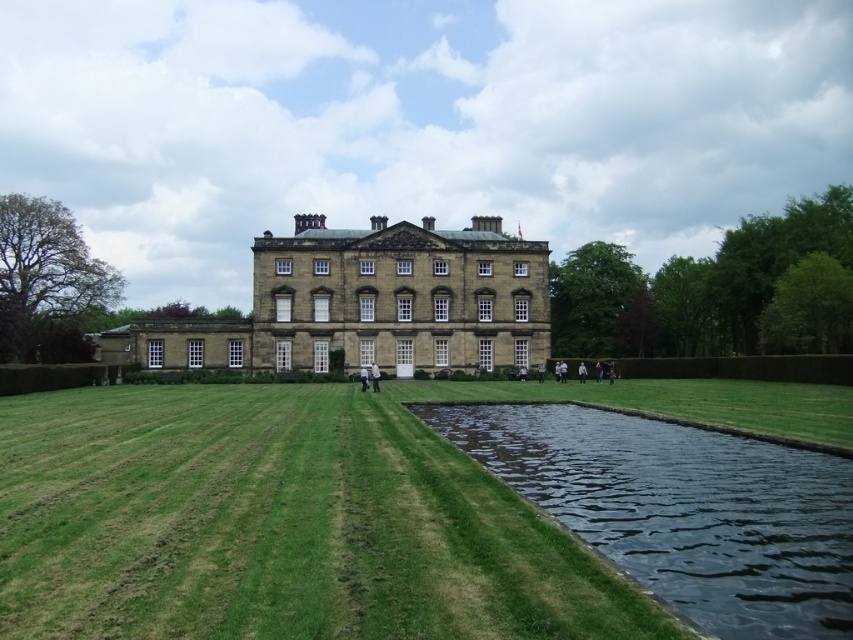
Can you confirm if dark reflective water at lower right is taller than brown stone mansion at center?

No.

Who is lower down, dark reflective water at lower right or brown stone mansion at center?

dark reflective water at lower right is lower down.

Locate an element on the screen. dark reflective water at lower right is located at coordinates (683, 509).

Find the location of `dark reflective water at lower right`. dark reflective water at lower right is located at coordinates (683, 509).

Can you confirm if green grass at center is thinner than dark reflective water at lower right?

In fact, green grass at center might be wider than dark reflective water at lower right.

What do you see at coordinates (276, 524) in the screenshot?
I see `green grass at center` at bounding box center [276, 524].

At what (x,y) coordinates should I click in order to perform the action: click on green grass at center. Please return your answer as a coordinate pair (x, y). The width and height of the screenshot is (853, 640). Looking at the image, I should click on (276, 524).

Between point (550, 541) and point (314, 256), which one is positioned in front?

Point (550, 541) is more forward.

You are a GUI agent. You are given a task and a screenshot of the screen. Output one action in this format:
    pyautogui.click(x=<x>, y=<y>)
    Task: Click on the green grass at center
    This screenshot has width=853, height=640.
    Given the screenshot: What is the action you would take?
    pyautogui.click(x=276, y=524)